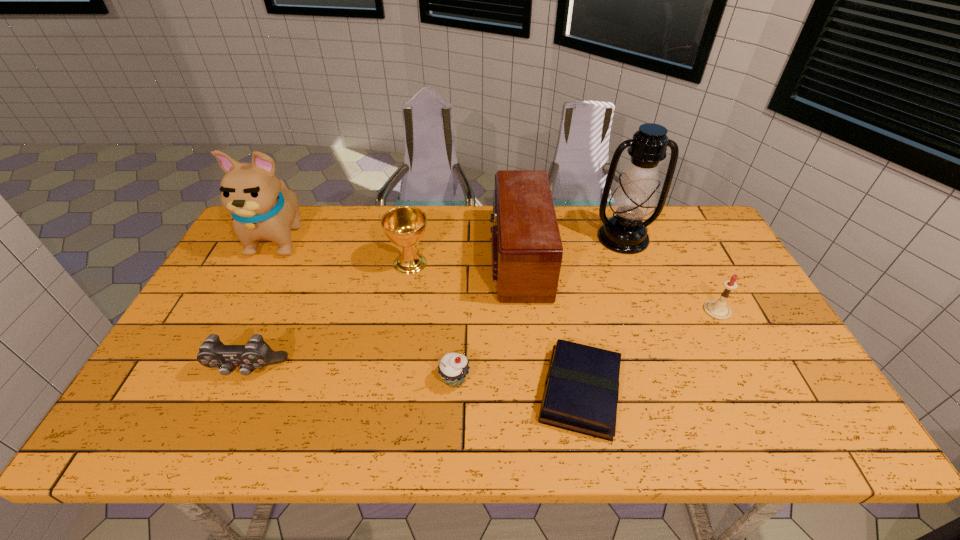
Identify the location of puppy located in the far edge section of the desktop. This screenshot has height=540, width=960. (262, 206).

At what (x,y) coordinates should I click in order to perform the action: click on radio receiver located in the far edge section of the desktop. Please return your answer as a coordinate pair (x, y). Looking at the image, I should click on (527, 251).

The width and height of the screenshot is (960, 540). Identify the location of object situated at the near edge. (581, 391).

Where is `puppy that is positioned at the left edge`? puppy that is positioned at the left edge is located at coordinates (262, 206).

I want to click on control at the left edge, so click(x=256, y=353).

You are a GUI agent. You are given a task and a screenshot of the screen. Output one action in this format:
    pyautogui.click(x=<x>, y=<y>)
    Task: Click on the object located in the right edge section of the desktop
    This screenshot has height=540, width=960.
    Given the screenshot: What is the action you would take?
    pyautogui.click(x=718, y=309)

Where is `object present at the far left corner`? This screenshot has width=960, height=540. object present at the far left corner is located at coordinates (262, 206).

Identify the location of vacant space at the far edge. The height and width of the screenshot is (540, 960). (415, 206).

The image size is (960, 540). In order to click on free space at the near edge of the desktop in this screenshot , I will do `click(432, 430)`.

This screenshot has width=960, height=540. In the image, there is a desktop. What are the coordinates of `vacant area at the left edge` in the screenshot? It's located at (267, 281).